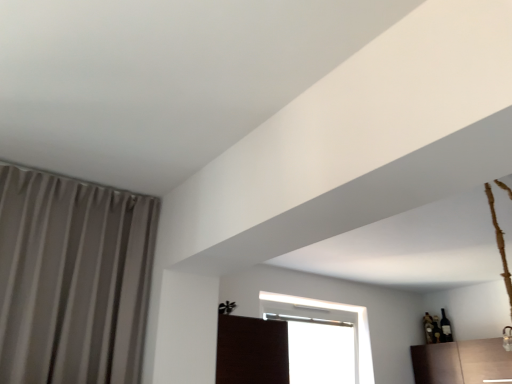
The width and height of the screenshot is (512, 384). Find the location of `transparent glass window at upper center`. transparent glass window at upper center is located at coordinates (339, 310).

This screenshot has height=384, width=512. What do you see at coordinates (339, 310) in the screenshot?
I see `transparent glass window at upper center` at bounding box center [339, 310].

Locate an element on the screen. This screenshot has height=384, width=512. transparent glass window at upper center is located at coordinates (339, 310).